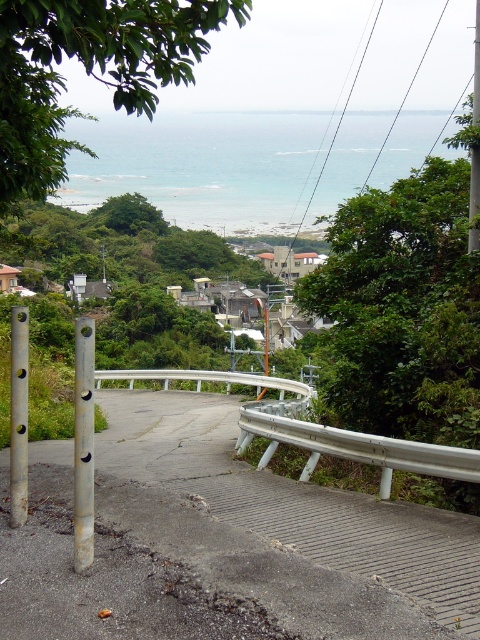
You are a hiker standing on the paved road and want to take a photo of the coastal view. You notice the silver metallic guardrail at lower right and the metallic pole at right in your camera frame. Which object is closer to the bottom edge of your photo?

The silver metallic guardrail at lower right is closer to the bottom edge of the photo because it is positioned below the metallic pole at right.

You are standing at the center of the road and want to ensure safety while walking. Which direction should you move to stay away from the silver metallic guardrail at lower right?

You should move to the left side of the road to stay away from the silver metallic guardrail at lower right, which is located at the right side of the road.

You are a surveyor tasked with marking the exact location of the gold metallic pole at left for a new construction project. According to the coordinates provided, where should you place the marker in relation to the road?

The gold metallic pole at left is located at coordinates point (84,444), which means the marker should be placed at those coordinates relative to the road.